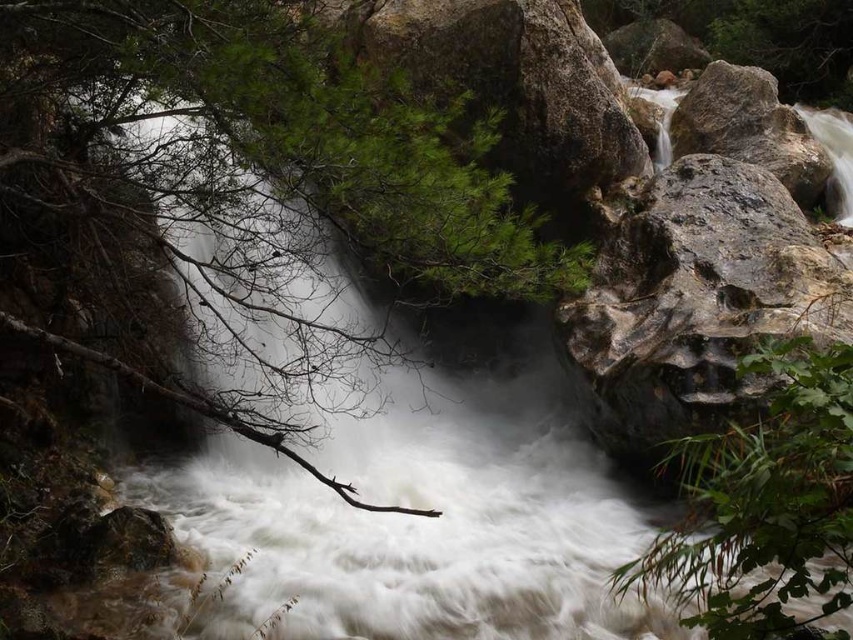
Question: Which object appears farthest from the camera in this image?

Choices:
 (A) gray rough rock at right
 (B) green leafy plant at lower right
 (C) rough textured rock at right

Answer: (A)

Question: Which of the following is the farthest from the observer?

Choices:
 (A) green leafy tree at upper left
 (B) rough textured rock at right
 (C) green leafy plant at lower right

Answer: (B)

Question: Can you confirm if green leafy tree at upper left is positioned to the left of green leafy plant at lower right?

Choices:
 (A) yes
 (B) no

Answer: (A)

Question: Is rough textured rock at right above green leafy plant at lower right?

Choices:
 (A) yes
 (B) no

Answer: (A)

Question: Does rough textured rock at right come in front of green leafy plant at lower right?

Choices:
 (A) yes
 (B) no

Answer: (B)

Question: Which point appears closest to the camera in this image?

Choices:
 (A) (784, 444)
 (B) (848, 250)

Answer: (A)